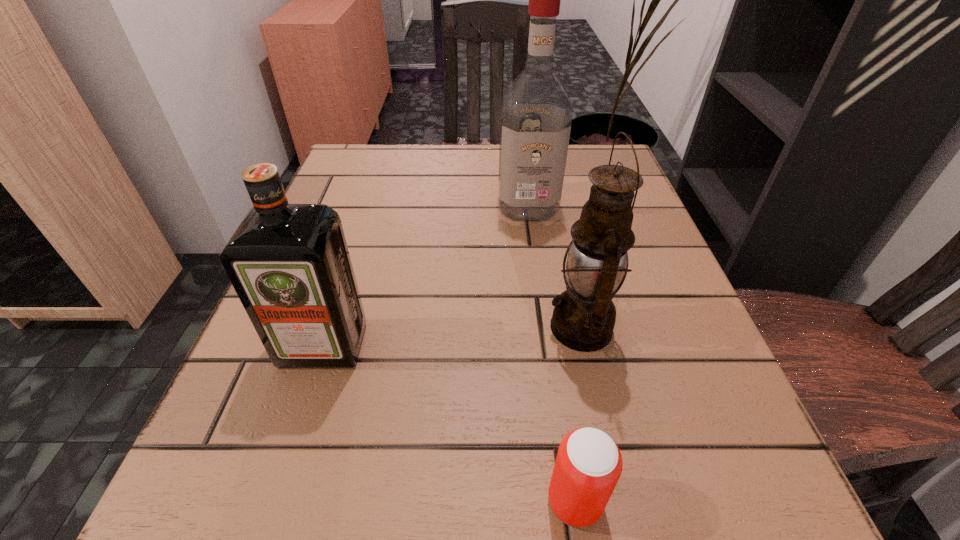
In order to click on empty space that is in between the beer can and the farther liquor in this screenshot , I will do `click(551, 353)`.

Locate an element on the screen. The width and height of the screenshot is (960, 540). free spot between the farthest object and the nearer liquor is located at coordinates (425, 275).

The height and width of the screenshot is (540, 960). In order to click on empty space between the right liquor and the beer can in this screenshot , I will do `click(551, 353)`.

Find the location of a particular element. The height and width of the screenshot is (540, 960). empty space between the farthest object and the left liquor is located at coordinates (425, 275).

I want to click on free space between the shorter liquor and the shortest object, so click(x=449, y=423).

Locate an element on the screen. This screenshot has height=540, width=960. vacant area that lies between the right liquor and the beer can is located at coordinates (551, 353).

The image size is (960, 540). What are the coordinates of `free spot between the oil lamp and the shortest object` in the screenshot? It's located at (578, 414).

You are a GUI agent. You are given a task and a screenshot of the screen. Output one action in this format:
    pyautogui.click(x=<x>, y=<y>)
    Task: Click on the free point between the leftmost object and the farthest object
    The image size is (960, 540).
    Given the screenshot: What is the action you would take?
    pyautogui.click(x=425, y=275)

Locate an element on the screen. free space between the beer can and the oil lamp is located at coordinates (578, 414).

Locate an element on the screen. free spot between the beer can and the oil lamp is located at coordinates (578, 414).